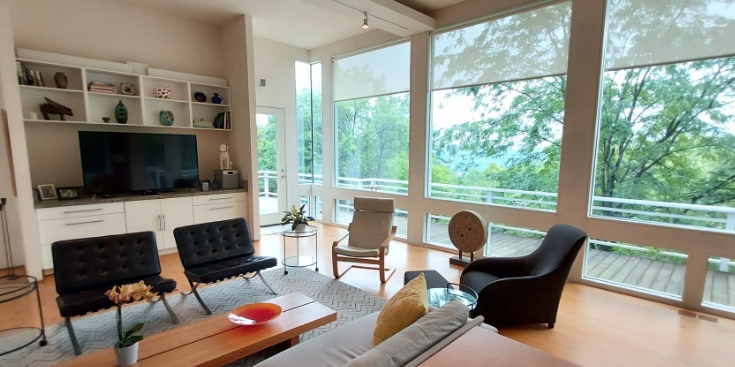
You are a GUI agent. You are given a task and a screenshot of the screen. Output one action in this format:
    pyautogui.click(x=<x>, y=<y>)
    Task: Click on the media console
    
    Given the screenshot: What is the action you would take?
    pyautogui.click(x=142, y=211)